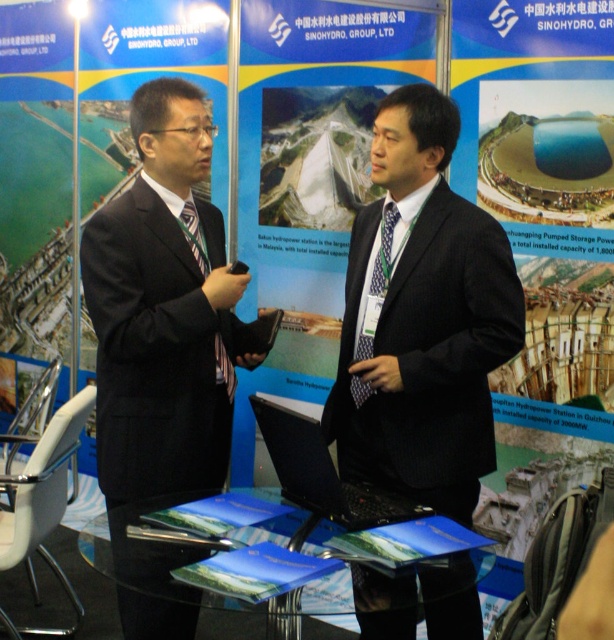
Based on the scene description, which individual is wearing the dark blue suit at center and is positioned in a way that might suggest they are the presenter? Could their suit width compared to the black suit at left indicate a professional hierarchy?

The dark blue suit at center is wider than the black suit at left, which might suggest a professional hierarchy where the presenter in the wider suit holds a higher position.